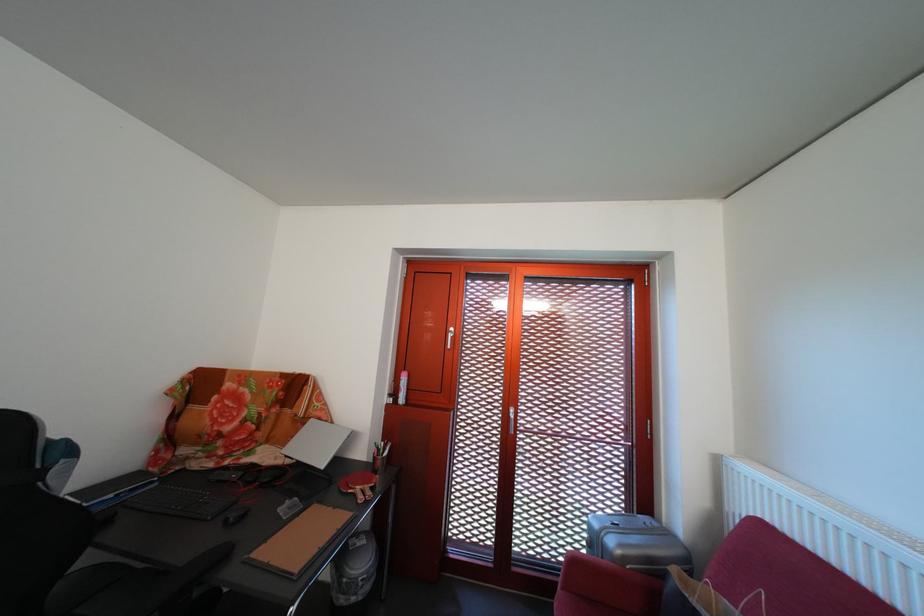
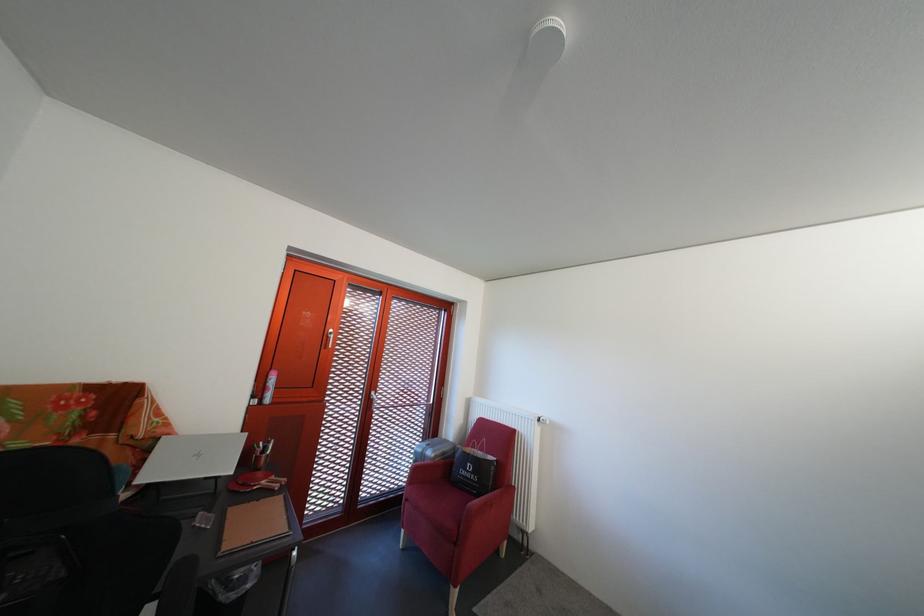
Where in the second image is the point corresponding to point (523, 416) from the first image?

(383, 400)